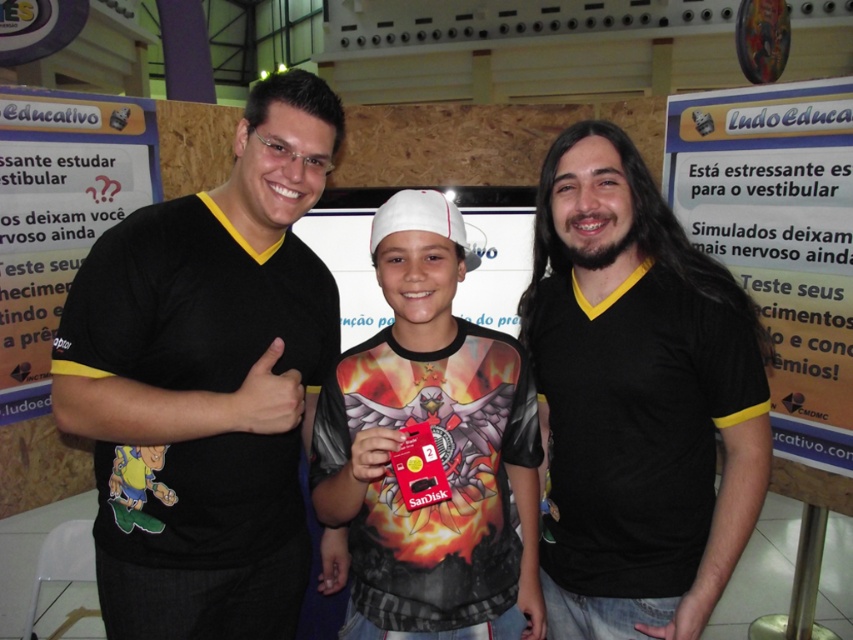
Can you confirm if black matte t-shirt at left is wider than black matte shirt at center?

Correct, the width of black matte t-shirt at left exceeds that of black matte shirt at center.

Who is more distant from viewer, (x=234, y=378) or (x=619, y=513)?

The point (x=619, y=513) is behind.

At what (x,y) coordinates should I click in order to perform the action: click on black matte t-shirt at left. Please return your answer as a coordinate pair (x, y). This screenshot has height=640, width=853. Looking at the image, I should click on (207, 384).

This screenshot has height=640, width=853. I want to click on black matte t-shirt at left, so click(x=207, y=384).

Is black matte t-shirt at left behind matte black cap at center?

That is True.

What are the coordinates of `black matte t-shirt at left` in the screenshot? It's located at (207, 384).

Find the location of a particular element. The image size is (853, 640). black matte t-shirt at left is located at coordinates (207, 384).

Can you confirm if black matte shirt at center is bigger than matte black cap at center?

Indeed, black matte shirt at center has a larger size compared to matte black cap at center.

Who is more forward, (653, 417) or (378, 593)?

Point (378, 593) is in front.

Find the location of `black matte shirt at center`. black matte shirt at center is located at coordinates (637, 400).